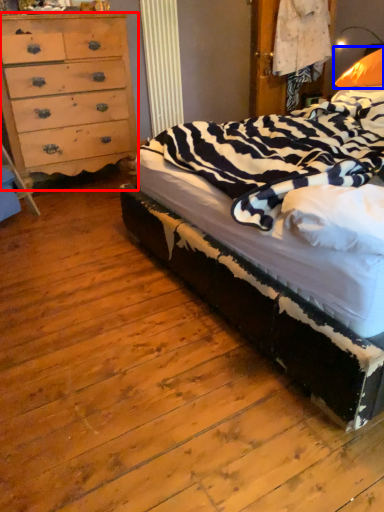
Question: Which point is further to the camera, chest of drawers (highlighted by a red box) or pillow (highlighted by a blue box)?

Choices:
 (A) chest of drawers
 (B) pillow

Answer: (A)